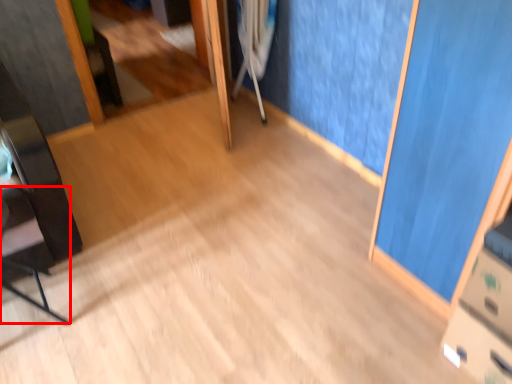
Question: From the image's perspective, where is chair (annotated by the red box) located in relation to crutch in the image?

Choices:
 (A) above
 (B) below

Answer: (B)